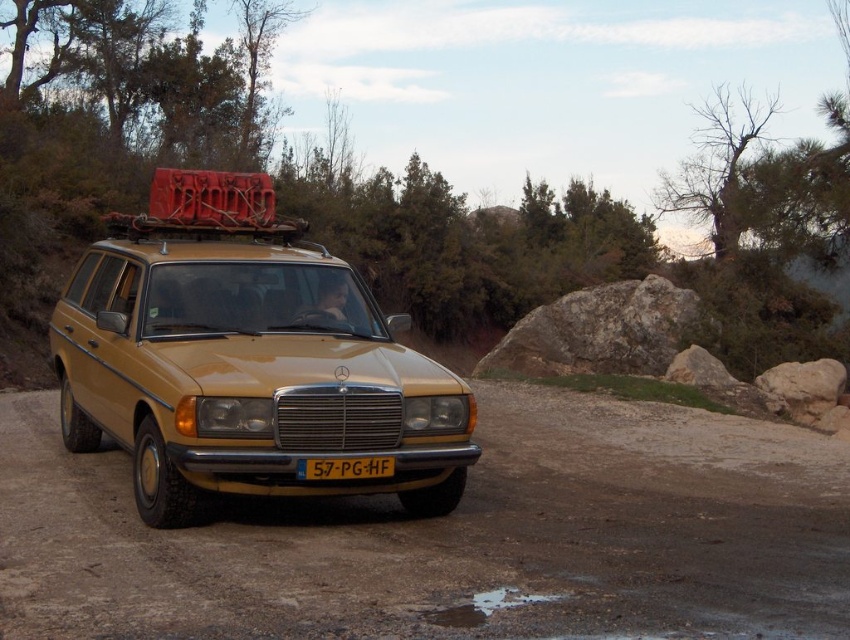
Who is positioned more to the left, matte yellow car at center or yellow matte license plate at center?

matte yellow car at center is more to the left.

Does matte yellow car at center come behind yellow matte license plate at center?

No.

Between point (401, 497) and point (374, 472), which one is positioned in front?

Positioned in front is point (374, 472).

Locate an element on the screen. The image size is (850, 640). matte yellow car at center is located at coordinates (248, 376).

Which is in front, point (37, 504) or point (202, 390)?

Positioned in front is point (202, 390).

Identify the location of dull yellow dirt track at center. Image resolution: width=850 pixels, height=640 pixels. (452, 536).

Can you confirm if dull yellow dirt track at center is positioned to the left of yellow matte license plate at center?

Correct, you'll find dull yellow dirt track at center to the left of yellow matte license plate at center.

Between dull yellow dirt track at center and yellow matte license plate at center, which one is positioned lower?

dull yellow dirt track at center

You are a GUI agent. You are given a task and a screenshot of the screen. Output one action in this format:
    pyautogui.click(x=<x>, y=<y>)
    Task: Click on the dull yellow dirt track at center
    Image resolution: width=850 pixels, height=640 pixels.
    Given the screenshot: What is the action you would take?
    click(x=452, y=536)